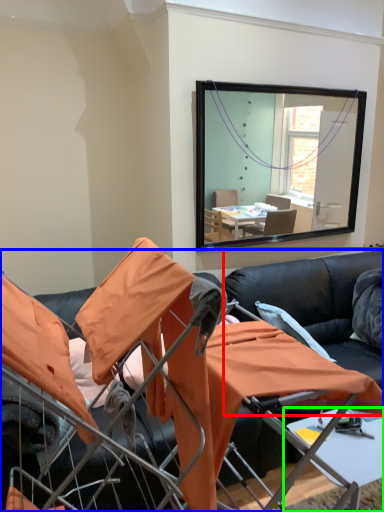
Question: Considering the real-world distances, which object is farthest from couch (highlighted by a red box)? studio couch (highlighted by a blue box) or table (highlighted by a green box)?

Choices:
 (A) studio couch
 (B) table

Answer: (A)